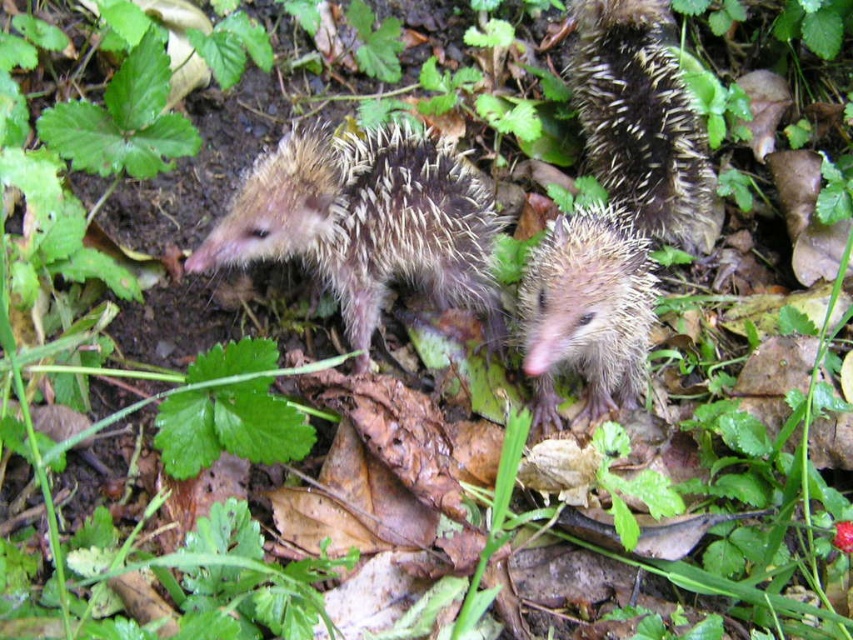
Can you confirm if fuzzy brown hedgehog at center is thinner than spiky brown hedgehog at upper right?

In fact, fuzzy brown hedgehog at center might be wider than spiky brown hedgehog at upper right.

Can you confirm if fuzzy brown hedgehog at center is bigger than spiky brown hedgehog at upper right?

Yes, fuzzy brown hedgehog at center is bigger than spiky brown hedgehog at upper right.

Is point (381, 172) closer to camera compared to point (683, 182)?

Yes.

Where is `fuzzy brown hedgehog at center`? fuzzy brown hedgehog at center is located at coordinates coord(366,221).

Does fuzzy brown hedgehog at center have a lesser height compared to brown spiny hedgehog at center?

Yes.

Who is higher up, fuzzy brown hedgehog at center or brown spiny hedgehog at center?

Positioned higher is fuzzy brown hedgehog at center.

The height and width of the screenshot is (640, 853). Find the location of `fuzzy brown hedgehog at center`. fuzzy brown hedgehog at center is located at coordinates (366, 221).

Find the location of `fuzzy brown hedgehog at center`. fuzzy brown hedgehog at center is located at coordinates (366, 221).

Does spiky brown hedgehog at upper right appear under brown spiny hedgehog at center?

Actually, spiky brown hedgehog at upper right is above brown spiny hedgehog at center.

Does spiky brown hedgehog at upper right have a lesser height compared to brown spiny hedgehog at center?

No, spiky brown hedgehog at upper right is not shorter than brown spiny hedgehog at center.

Which is in front, point (592, 124) or point (637, 282)?

Point (637, 282)

At what (x,y) coordinates should I click in order to perform the action: click on spiky brown hedgehog at upper right. Please return your answer as a coordinate pair (x, y). Looking at the image, I should click on (641, 120).